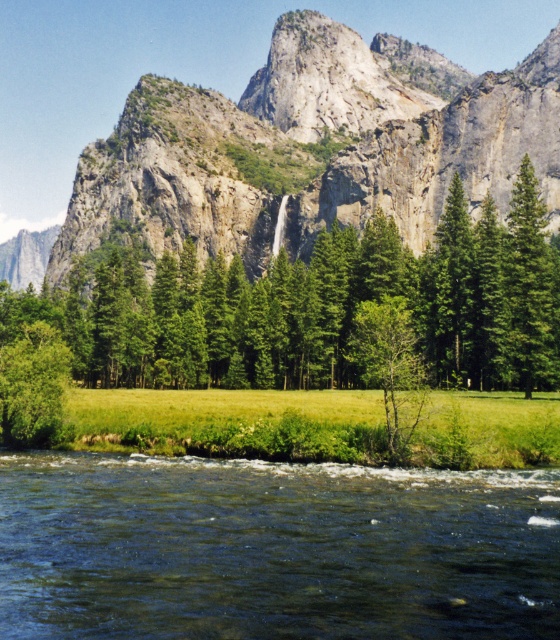
Question: Which point is closer to the camera?

Choices:
 (A) green leafy tree at center
 (B) dark green water at lower center

Answer: (B)

Question: Which of the following is the closest to the observer?

Choices:
 (A) (361, 323)
 (B) (96, 504)

Answer: (B)

Question: Is dark green water at lower center bigger than green leafy tree at center?

Choices:
 (A) no
 (B) yes

Answer: (A)

Question: Is dark green water at lower center thinner than green leafy tree at center?

Choices:
 (A) no
 (B) yes

Answer: (A)

Question: Among these points, which one is farthest from the camera?

Choices:
 (A) (414, 378)
 (B) (132, 529)

Answer: (A)

Question: From the image, what is the correct spatial relationship of dark green water at lower center in relation to green leafy tree at center?

Choices:
 (A) above
 (B) below

Answer: (B)